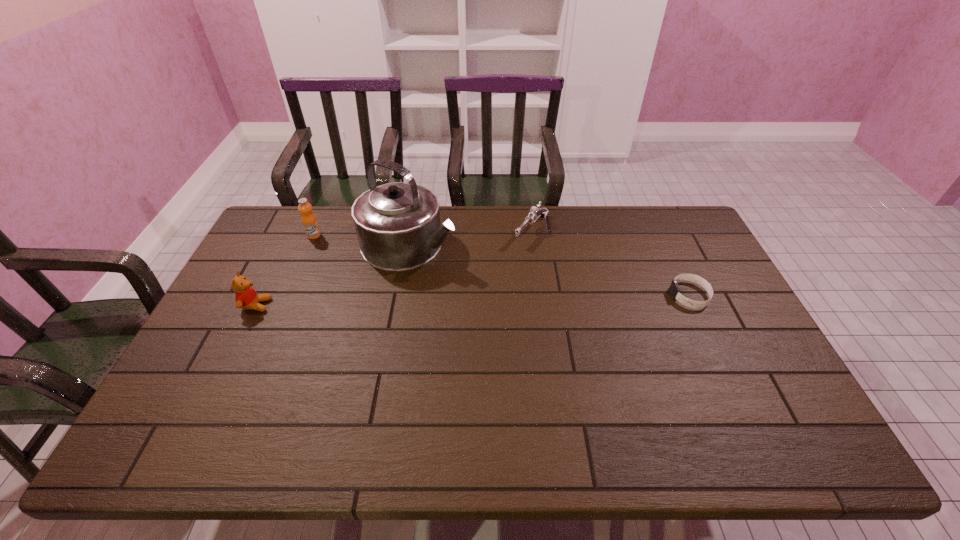
Identify the location of the leftmost object. (246, 297).

Where is `the third tallest object`? Image resolution: width=960 pixels, height=540 pixels. the third tallest object is located at coordinates (246, 297).

You are a GUI agent. You are given a task and a screenshot of the screen. Output one action in this format:
    pyautogui.click(x=<x>, y=<y>)
    Task: Click on the shortest object
    
    Given the screenshot: What is the action you would take?
    pyautogui.click(x=674, y=289)

This screenshot has height=540, width=960. I want to click on the rightmost object, so click(x=674, y=289).

Locate an element on the screen. The image size is (960, 540). gun is located at coordinates (535, 213).

The width and height of the screenshot is (960, 540). I want to click on the fourth tallest object, so click(x=535, y=213).

The height and width of the screenshot is (540, 960). What are the coordinates of `kettle` in the screenshot? It's located at (398, 227).

Identify the location of the third object from left to right. (398, 227).

Image resolution: width=960 pixels, height=540 pixels. What are the coordinates of `orange juice` in the screenshot? It's located at (309, 221).

What are the coordinates of `the second object from left to right` in the screenshot? It's located at (309, 221).